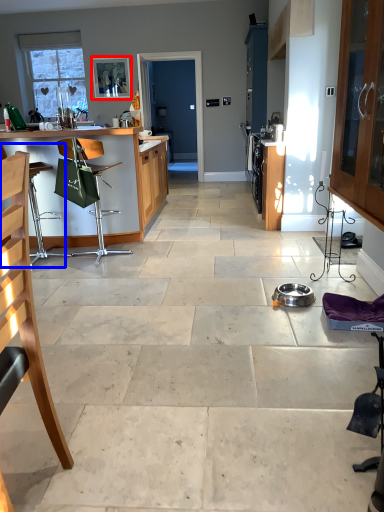
Question: Which of the following is the farthest to the observer, picture frame (highlighted by a red box) or armchair (highlighted by a blue box)?

Choices:
 (A) picture frame
 (B) armchair

Answer: (A)